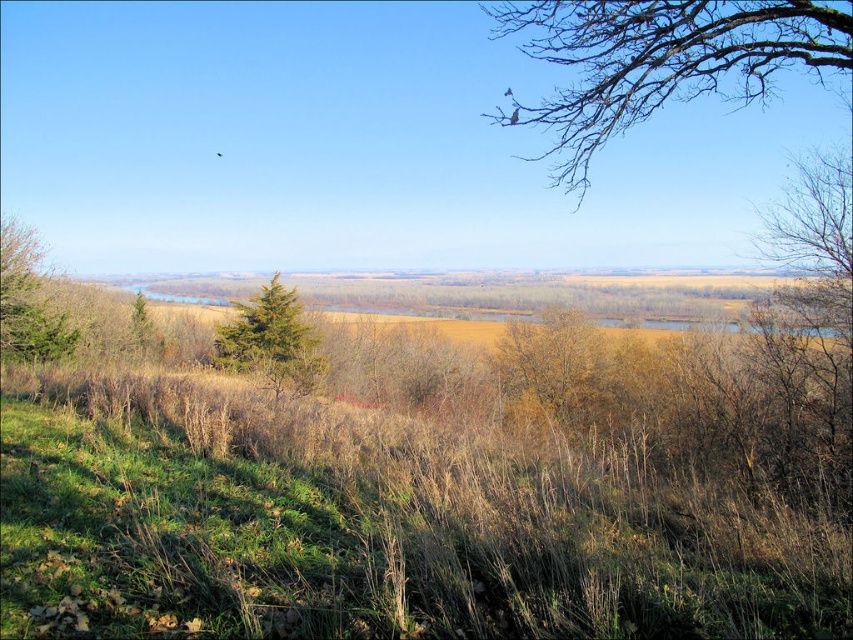
Question: Is green textured tree at center closer to the viewer compared to green matte tree at left?

Choices:
 (A) no
 (B) yes

Answer: (B)

Question: Is bare branches at upper right below green textured tree at center?

Choices:
 (A) yes
 (B) no

Answer: (B)

Question: Which point is closer to the camera?

Choices:
 (A) green matte tree at left
 (B) bare branches at upper right

Answer: (B)

Question: Which point is closer to the camera?

Choices:
 (A) (28, 348)
 (B) (273, 364)

Answer: (B)

Question: Is bare branches at upper right positioned behind green textured tree at center?

Choices:
 (A) no
 (B) yes

Answer: (A)

Question: Which point is closer to the camera taking this photo?

Choices:
 (A) (575, 36)
 (B) (3, 344)

Answer: (B)